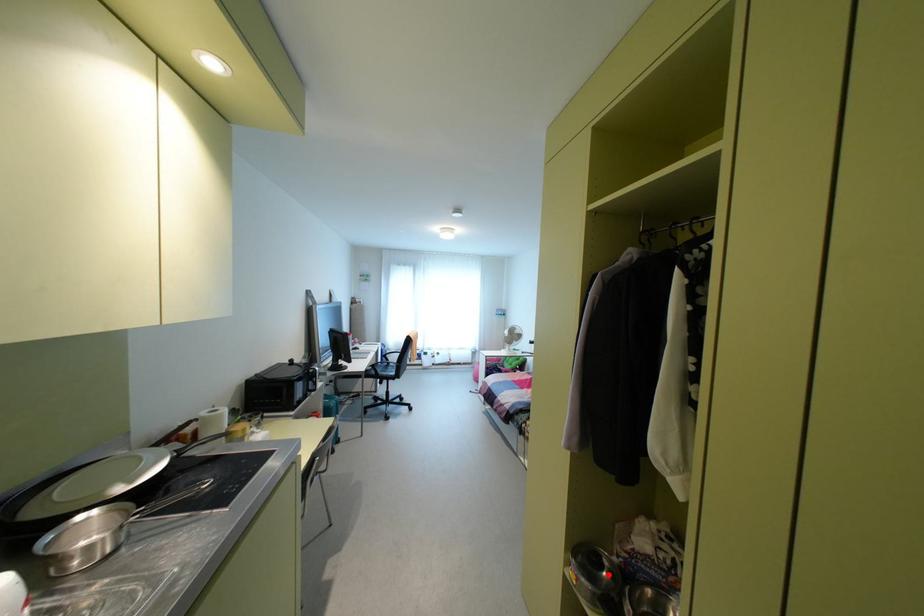
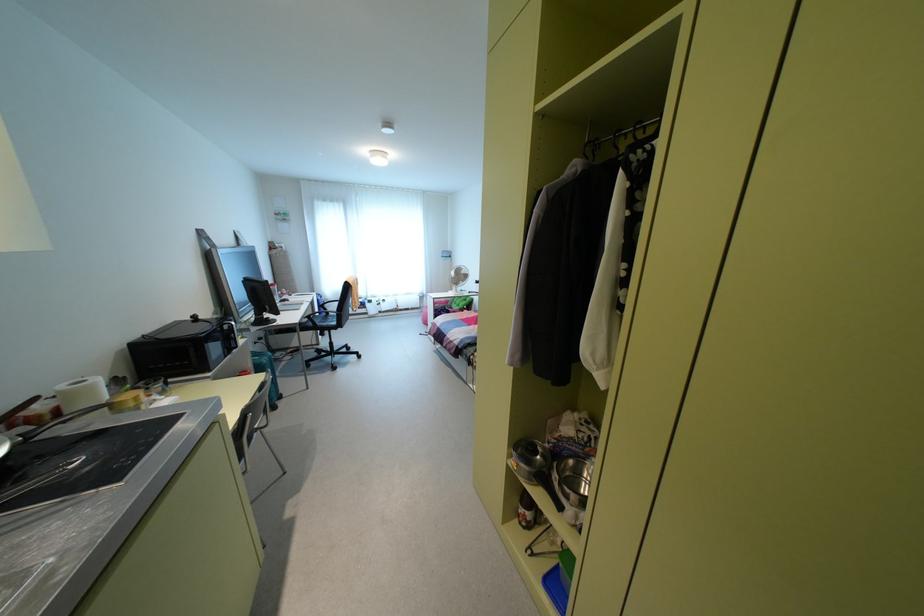
The point at the highlighted location is marked in the first image. Where is the corresponding point in the second image?

(541, 456)